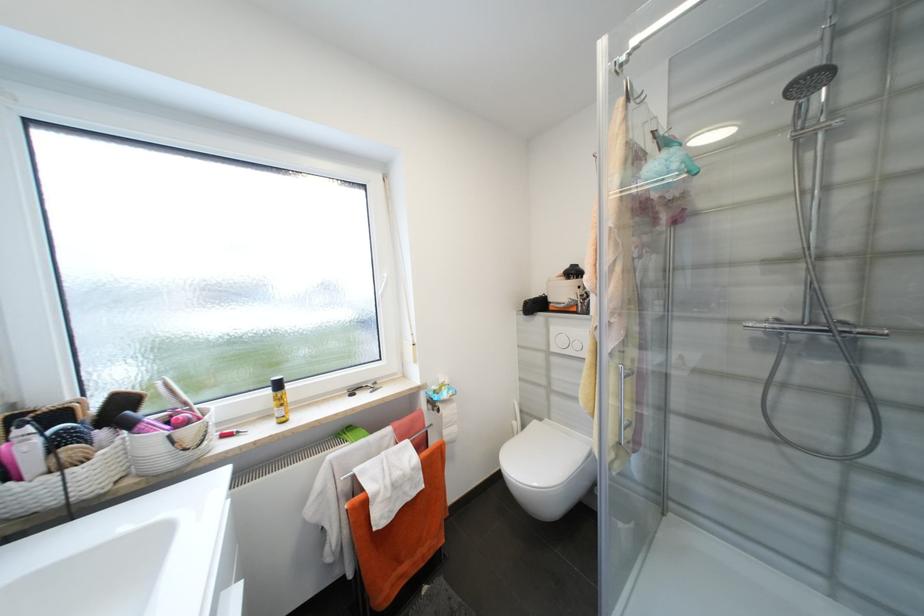
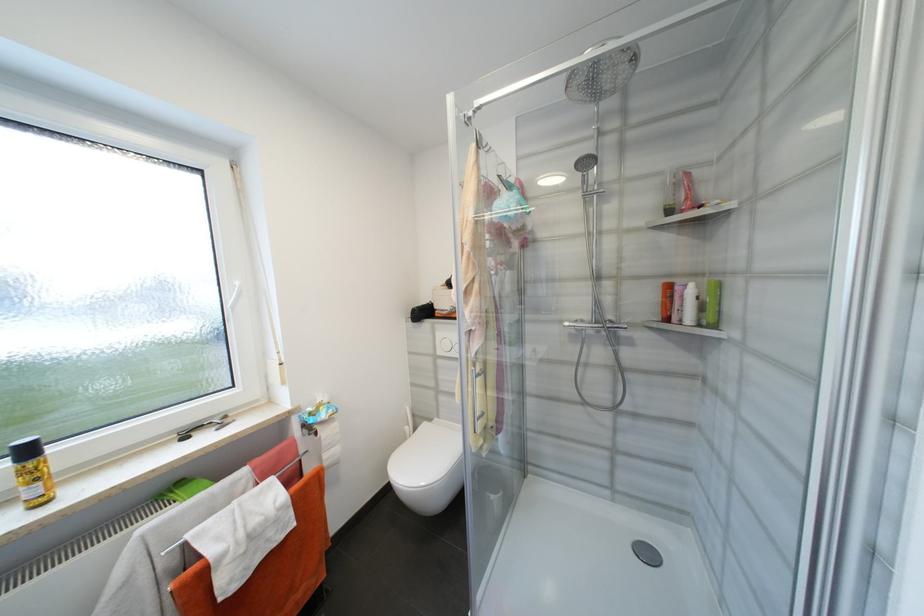
Locate, in the second image, the point that corresponds to the point at 284,386 in the first image.

(33, 453)